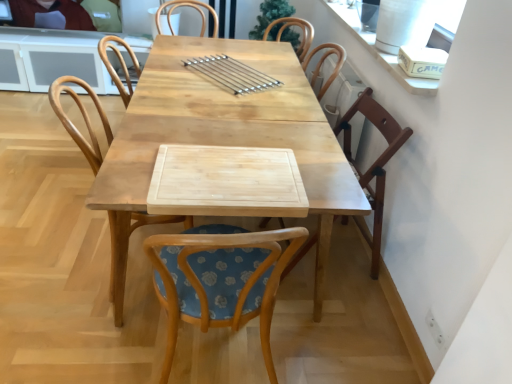
I want to click on vacant space in front of wooden chair at center, which is the third chair from right to left, so click(92, 340).